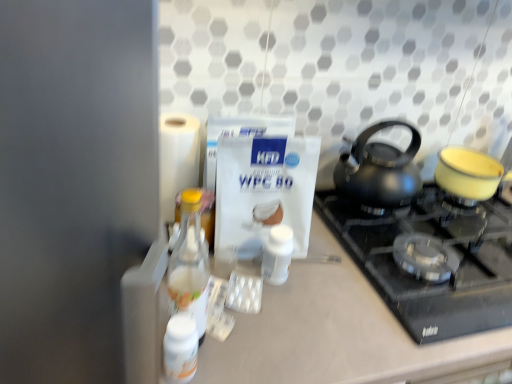
This screenshot has height=384, width=512. I want to click on free space to the left of white matte bottle at center, which is the 1th bottle from right to left, so click(x=231, y=274).